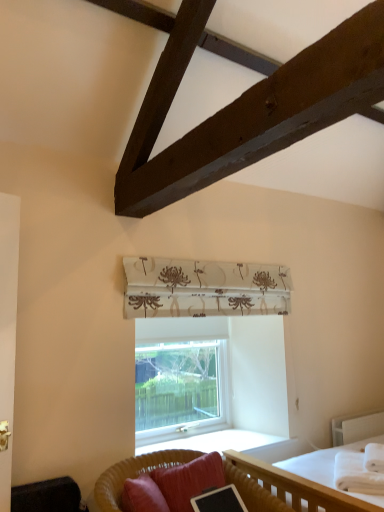
Question: Is white soft blanket at lower right located outside clear glass window at center?

Choices:
 (A) no
 (B) yes

Answer: (B)

Question: From the image's perspective, is white soft blanket at lower right on top of clear glass window at center?

Choices:
 (A) yes
 (B) no

Answer: (B)

Question: Does white soft blanket at lower right have a lesser height compared to clear glass window at center?

Choices:
 (A) yes
 (B) no

Answer: (A)

Question: Considering the relative positions of white soft blanket at lower right and clear glass window at center in the image provided, is white soft blanket at lower right to the left of clear glass window at center from the viewer's perspective?

Choices:
 (A) no
 (B) yes

Answer: (A)

Question: Considering the relative sizes of white soft blanket at lower right and clear glass window at center in the image provided, is white soft blanket at lower right bigger than clear glass window at center?

Choices:
 (A) no
 (B) yes

Answer: (A)

Question: Considering the positions of velvet black swivel chair at lower left and clear glass window at center in the image, is velvet black swivel chair at lower left bigger or smaller than clear glass window at center?

Choices:
 (A) big
 (B) small

Answer: (B)

Question: Considering their positions, is velvet black swivel chair at lower left located in front of or behind clear glass window at center?

Choices:
 (A) behind
 (B) front

Answer: (B)

Question: From a real-world perspective, is velvet black swivel chair at lower left above or below clear glass window at center?

Choices:
 (A) below
 (B) above

Answer: (A)

Question: Is velvet black swivel chair at lower left inside the boundaries of clear glass window at center, or outside?

Choices:
 (A) inside
 (B) outside

Answer: (B)

Question: Considering the positions of point (49, 495) and point (334, 444), is point (49, 495) closer or farther from the camera than point (334, 444)?

Choices:
 (A) closer
 (B) farther

Answer: (A)

Question: Considering the relative positions of velvet black swivel chair at lower left and white textured balustrade at lower right in the image provided, is velvet black swivel chair at lower left to the left or to the right of white textured balustrade at lower right?

Choices:
 (A) right
 (B) left

Answer: (B)

Question: Do you think velvet black swivel chair at lower left is within white textured balustrade at lower right, or outside of it?

Choices:
 (A) inside
 (B) outside

Answer: (B)

Question: Considering the positions of velvet black swivel chair at lower left and white textured balustrade at lower right in the image, is velvet black swivel chair at lower left wider or thinner than white textured balustrade at lower right?

Choices:
 (A) thin
 (B) wide

Answer: (B)

Question: From a real-world perspective, is woven rattan studio couch at lower center positioned above or below velvet black swivel chair at lower left?

Choices:
 (A) above
 (B) below

Answer: (B)

Question: In terms of height, does woven rattan studio couch at lower center look taller or shorter compared to velvet black swivel chair at lower left?

Choices:
 (A) short
 (B) tall

Answer: (B)